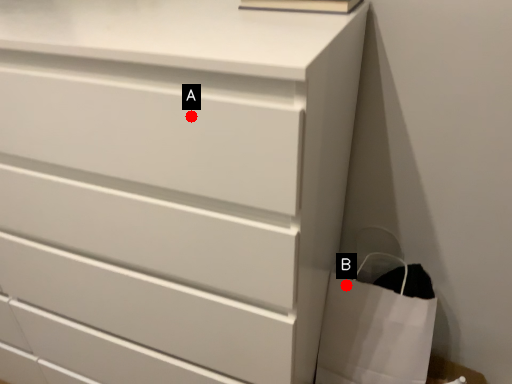
Question: Two points are circled on the image, labeled by A and B beside each circle. Which point appears closest to the camera in this image?

Choices:
 (A) A is closer
 (B) B is closer

Answer: (A)